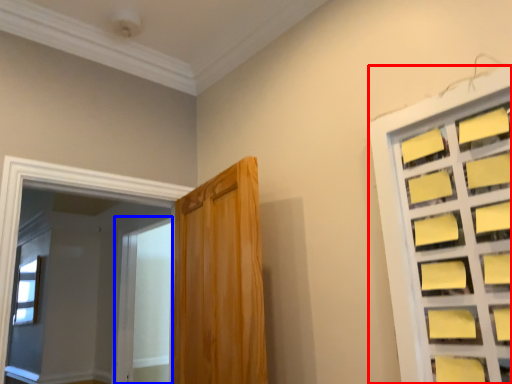
Question: Which object appears closest to the camera in this image, window (highlighted by a red box) or screen door (highlighted by a blue box)?

Choices:
 (A) window
 (B) screen door

Answer: (A)